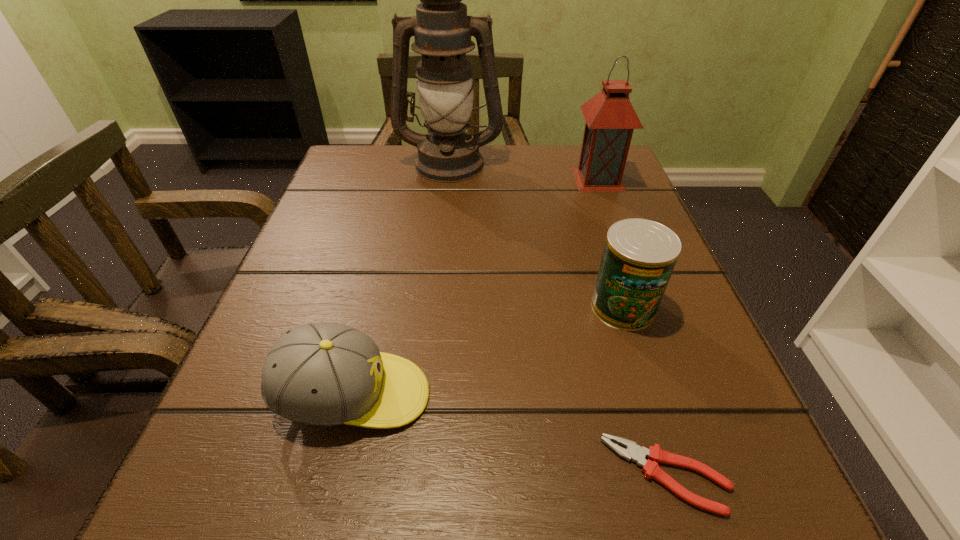
Where is `oil lamp`? oil lamp is located at coordinates (442, 30).

This screenshot has width=960, height=540. What are the coordinates of `the fourth shortest object` in the screenshot? It's located at (610, 118).

At what (x,y) coordinates should I click in order to perform the action: click on the third shortest object. Please return your answer as a coordinate pair (x, y). This screenshot has width=960, height=540. Looking at the image, I should click on (639, 255).

Find the location of a particular element. The width and height of the screenshot is (960, 540). can is located at coordinates (639, 255).

You are a GUI agent. You are given a task and a screenshot of the screen. Output one action in this format:
    pyautogui.click(x=<x>, y=<y>)
    Task: Click on the fourth tallest object
    This screenshot has height=540, width=960.
    Given the screenshot: What is the action you would take?
    pyautogui.click(x=326, y=374)

What are the coordinates of `the shortest object` in the screenshot? It's located at (636, 453).

This screenshot has height=540, width=960. What are the coordinates of `vacant space situated 0.170m on the right of the tallest object` in the screenshot? It's located at (575, 163).

Identify the location of vacant space located on the front of the fourth shortest object. (639, 288).

Where is `free space located on the left of the third shortest object`? This screenshot has height=540, width=960. free space located on the left of the third shortest object is located at coordinates (394, 307).

In order to click on free space located on the front-facing side of the baseball cap in this screenshot , I will do tap(514, 396).